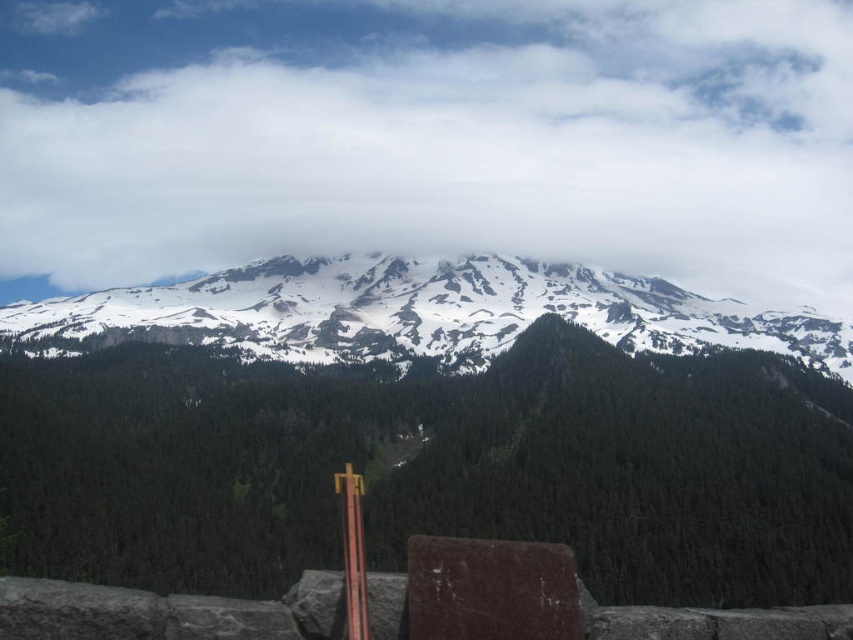
Question: Estimate the real-world distances between objects in this image. Which object is farther from the white fluffy cloud at upper center?

Choices:
 (A) brown rough stone at center
 (B) smooth wood pole at center
 (C) snowy rock at upper center

Answer: (A)

Question: Can you confirm if snowy rock at upper center is positioned to the right of brown rough stone at center?

Choices:
 (A) no
 (B) yes

Answer: (A)

Question: Which of the following is the closest to the observer?

Choices:
 (A) (347, 568)
 (B) (845, 589)
 (C) (782, 332)
 (D) (463, 566)

Answer: (D)

Question: Is snowy rock at upper center above smooth wood pole at center?

Choices:
 (A) no
 (B) yes

Answer: (B)

Question: Does snowy rock at upper center appear under white fluffy cloud at upper center?

Choices:
 (A) yes
 (B) no

Answer: (A)

Question: Which point appears closest to the camera in this image?

Choices:
 (A) (357, 616)
 (B) (677, 346)
 (C) (550, 620)
 (D) (534, 216)

Answer: (C)